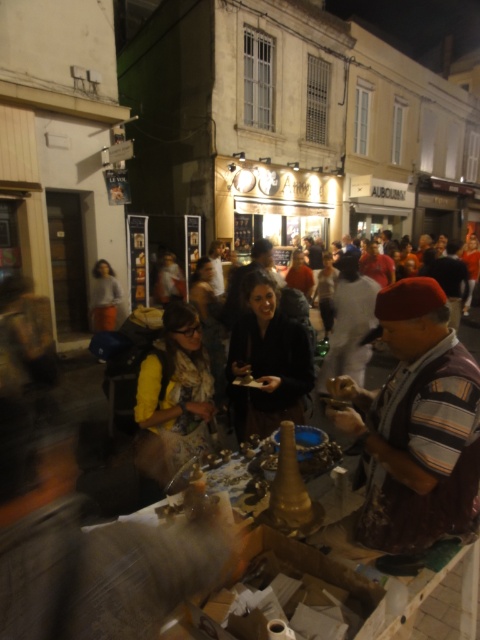
You are standing at the entrance of the vendor stall and want to reach the striped fabric beret at center. Which direction should you move in to get closer to it?

The striped fabric beret at center is located at point 0.666 on the x axis and 0.865 on the y axis. Since you are at the entrance, which is likely at the lower left corner of the stall, you should move towards the upper right direction to reach it.

You are a customer at the market and want to buy a striped fabric beret at center and a dark brown leather jacket at center. If you have a bag that can only hold items up to 30 cm in width, which item can you safely put in first without exceeding the bag limit?

The striped fabric beret at center has a width less than the dark brown leather jacket at center, so you can safely put the striped fabric beret at center in the bag first without exceeding the 30 cm width limit.